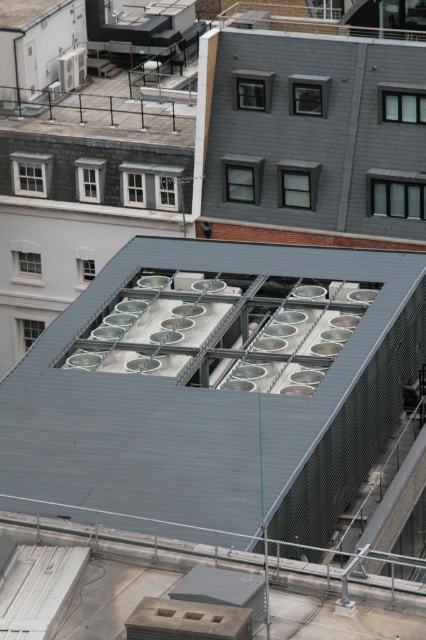
You are standing on the rooftop of a building and looking around. There is a point marked at coordinates (215, 392). What is the color of the surface at that point?

The point (215, 392) is part of the metallic gray roof at center, so the surface color there is metallic gray.

From the picture: You are an architect analyzing the rooftop layout. Based on the scene, which of the two roofs, the metallic gray roof at center or the gray matte roof at upper center, has a lower elevation?

The metallic gray roof at center is shorter than the gray matte roof at upper center, so the metallic gray roof at center has a lower elevation.